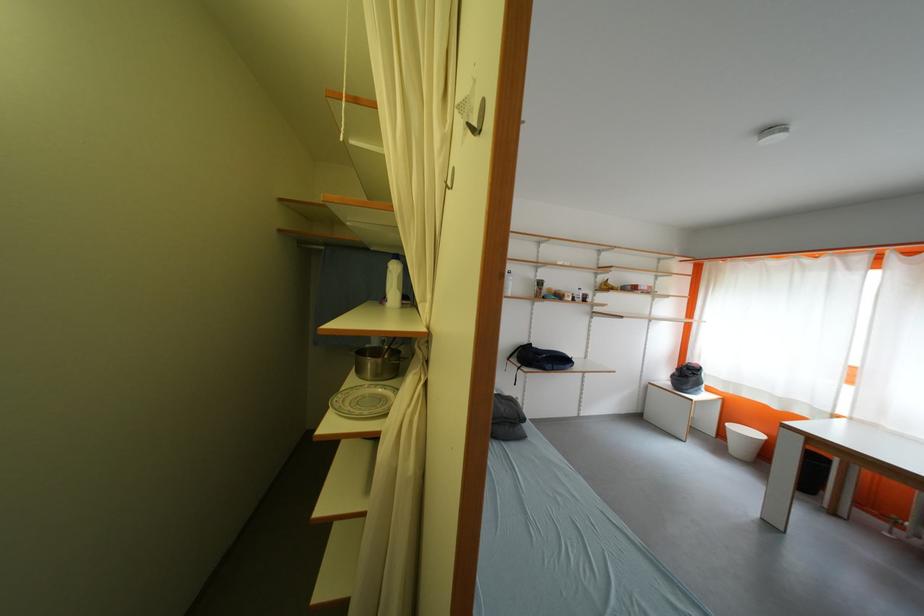
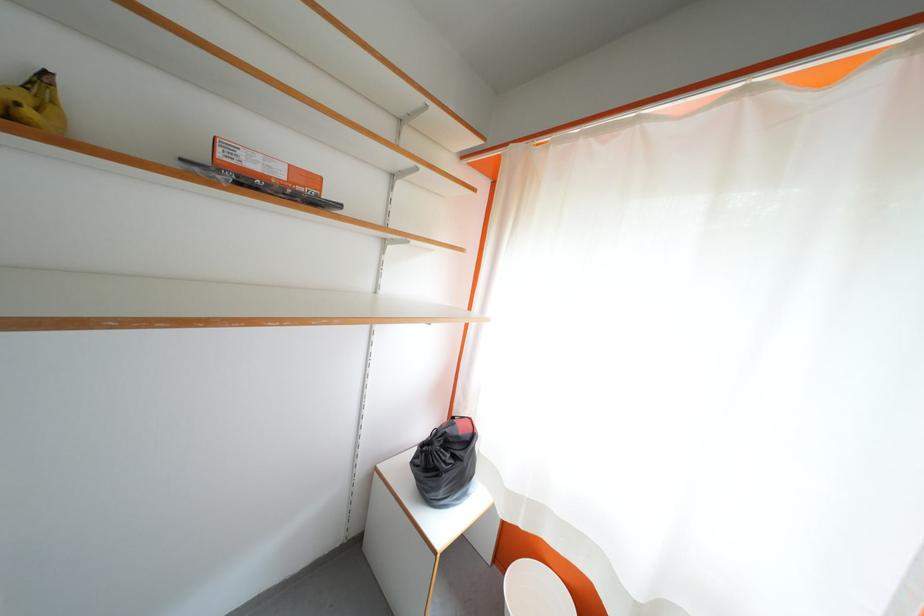
The point at (697, 379) is marked in the first image. Where is the corresponding point in the second image?

(455, 460)